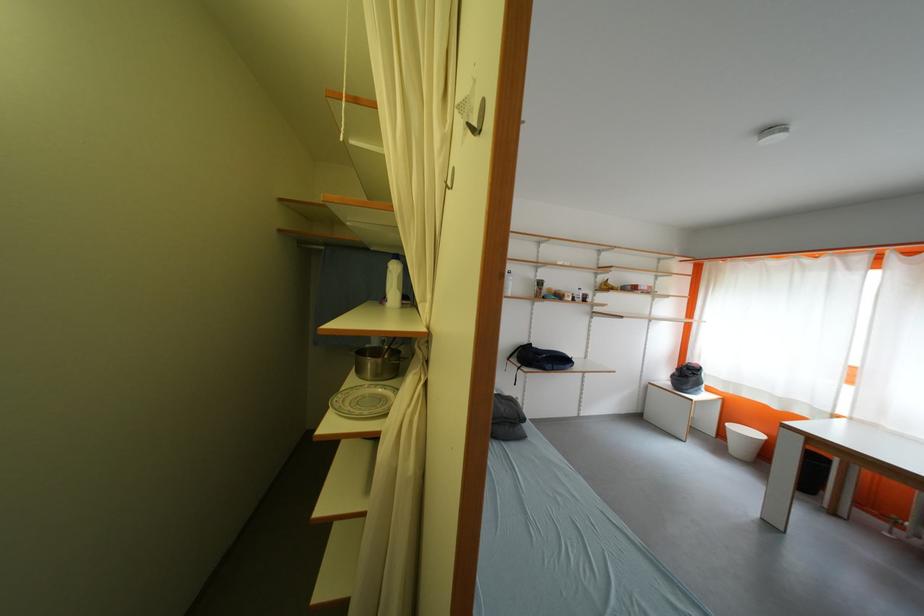
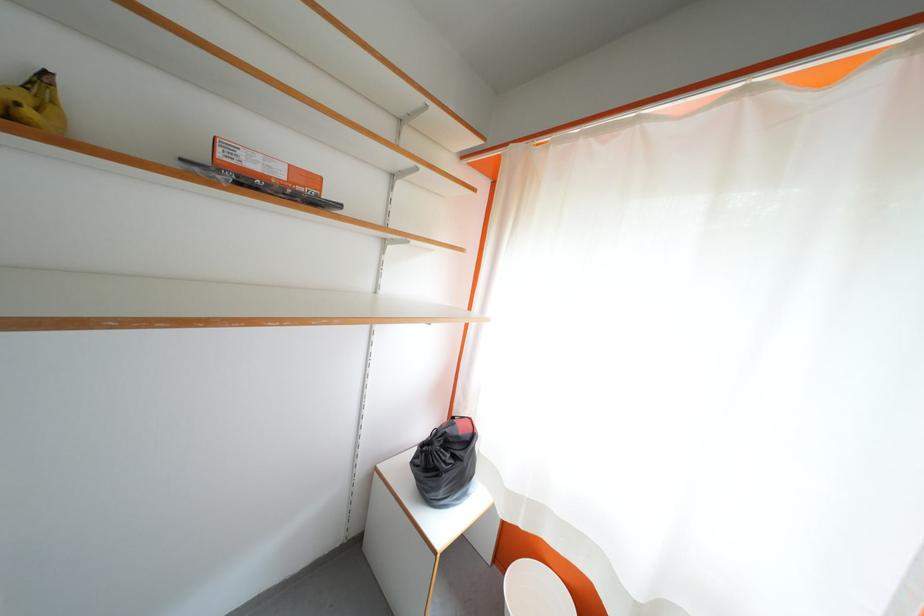
The point at (697, 379) is marked in the first image. Where is the corresponding point in the second image?

(455, 460)